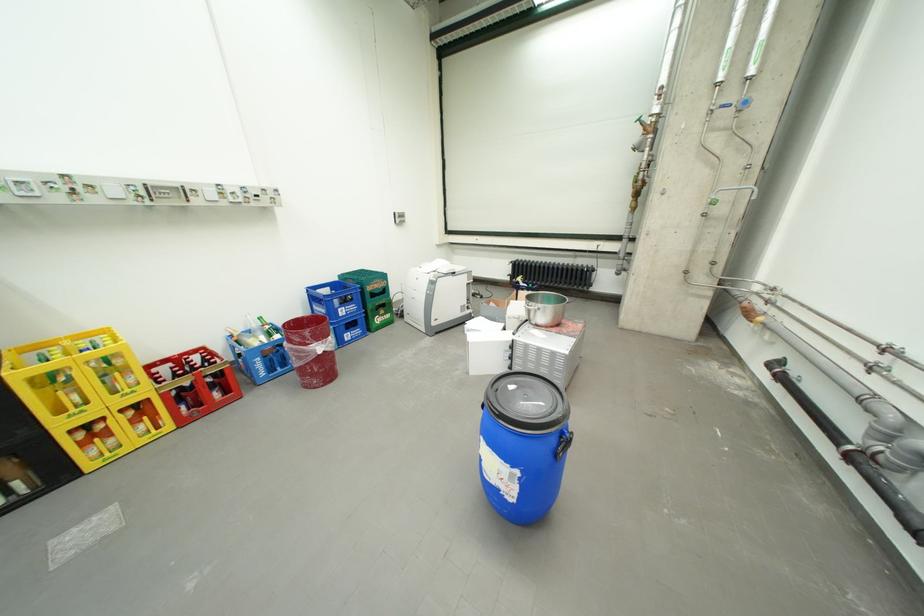
Locate an element on the screen. Image resolution: width=924 pixels, height=616 pixels. yellow crate is located at coordinates (44, 379).